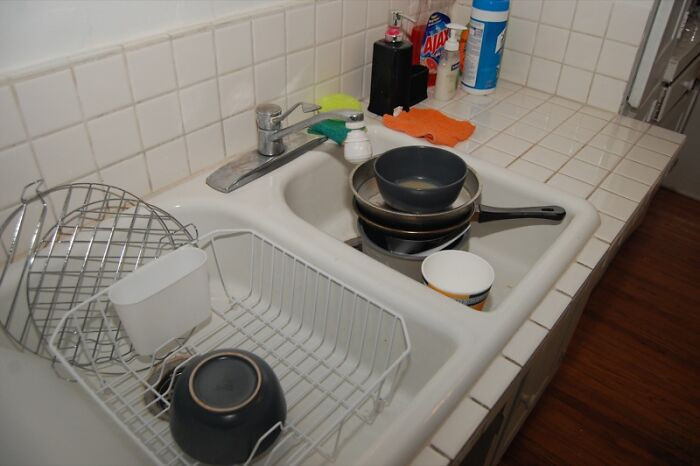
Locate an element on the screen. faucet is located at coordinates (341, 115).